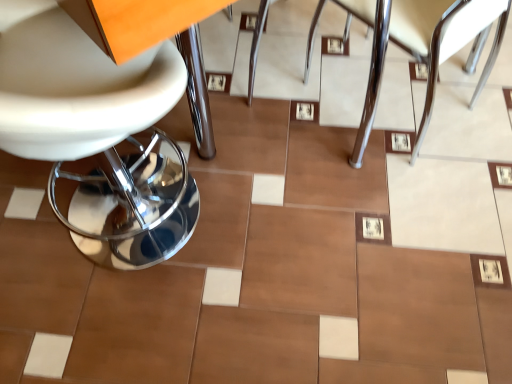
I want to click on vacant space underneath white leather chair at left, the 1th chair from the left (from a real-world perspective), so click(x=112, y=233).